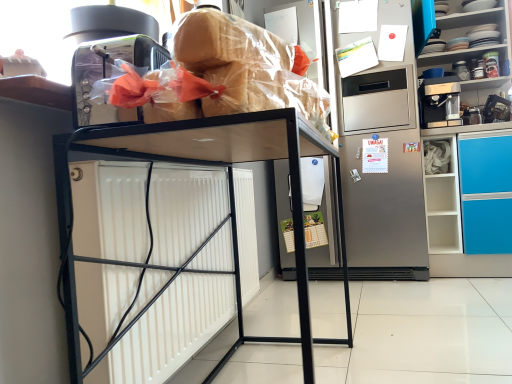
Question: From the image's perspective, is translucent plastic bread at upper center above stainless steel refrigerator at center?

Choices:
 (A) yes
 (B) no

Answer: (A)

Question: From the image's perspective, is translucent plastic bread at upper center located beneath stainless steel refrigerator at center?

Choices:
 (A) no
 (B) yes

Answer: (A)

Question: Is the depth of translucent plastic bread at upper center less than that of stainless steel refrigerator at center?

Choices:
 (A) yes
 (B) no

Answer: (A)

Question: Is translucent plastic bread at upper center smaller than stainless steel refrigerator at center?

Choices:
 (A) yes
 (B) no

Answer: (A)

Question: Is stainless steel refrigerator at center inside translucent plastic bread at upper center?

Choices:
 (A) yes
 (B) no

Answer: (B)

Question: In terms of size, does stainless steel refrigerator at center appear bigger or smaller than translucent plastic bread at upper center?

Choices:
 (A) big
 (B) small

Answer: (A)

Question: From a real-world perspective, relative to translucent plastic bread at upper center, is stainless steel refrigerator at center vertically above or below?

Choices:
 (A) below
 (B) above

Answer: (A)

Question: Does point (419, 180) appear closer or farther from the camera than point (300, 69)?

Choices:
 (A) closer
 (B) farther

Answer: (B)

Question: Is stainless steel refrigerator at center taller or shorter than translucent plastic bread at upper center?

Choices:
 (A) short
 (B) tall

Answer: (B)

Question: Is point (360, 175) closer or farther from the camera than point (462, 79)?

Choices:
 (A) closer
 (B) farther

Answer: (A)

Question: Considering the positions of stainless steel refrigerator at center and porcelain plates at upper right in the image, is stainless steel refrigerator at center wider or thinner than porcelain plates at upper right?

Choices:
 (A) thin
 (B) wide

Answer: (A)

Question: In terms of size, does stainless steel refrigerator at center appear bigger or smaller than porcelain plates at upper right?

Choices:
 (A) small
 (B) big

Answer: (B)

Question: In the image, is stainless steel refrigerator at center positioned in front of or behind porcelain plates at upper right?

Choices:
 (A) behind
 (B) front

Answer: (A)

Question: Is black metal shelf at center taller or shorter than porcelain plates at upper right?

Choices:
 (A) tall
 (B) short

Answer: (A)

Question: In the image, is black metal shelf at center positioned in front of or behind porcelain plates at upper right?

Choices:
 (A) behind
 (B) front

Answer: (B)